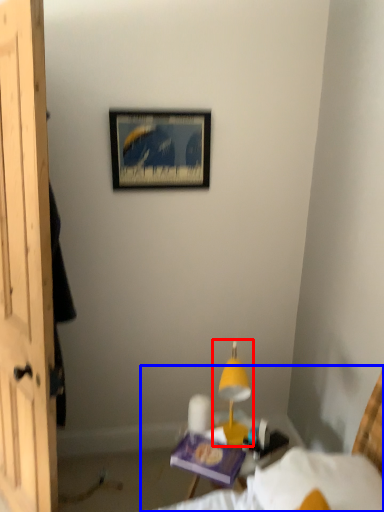
Question: Which of the following is the closest to the observer, table lamp (highlighted by a red box) or bed (highlighted by a blue box)?

Choices:
 (A) table lamp
 (B) bed

Answer: (B)